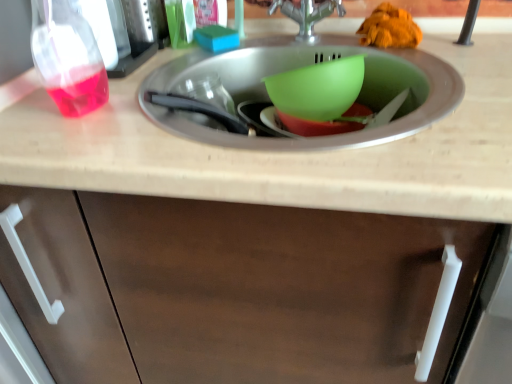
Locate an element on the screen. vacant space in front of transparent plastic spray bottle at left is located at coordinates (100, 92).